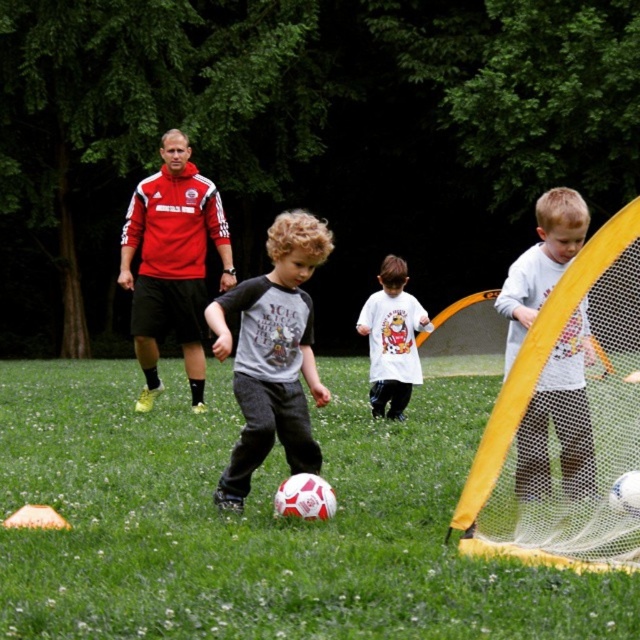
The width and height of the screenshot is (640, 640). What are the coordinates of `gray cotton shirt at center` in the screenshot? It's located at [x=273, y=355].

Is point (230, 305) closer to camera compared to point (161, 266)?

Yes, it is.

Where is `gray cotton shirt at center`? gray cotton shirt at center is located at coordinates (273, 355).

Locate an element on the screen. Image resolution: width=640 pixels, height=640 pixels. white matte soccer ball at center is located at coordinates (259, 520).

In the scene shown: Between white matte soccer ball at center and white matte t-shirt at center, which one appears on the left side from the viewer's perspective?

white matte soccer ball at center

Identify the location of white matte soccer ball at center. (259, 520).

This screenshot has height=640, width=640. I want to click on white matte soccer ball at center, so (x=259, y=520).